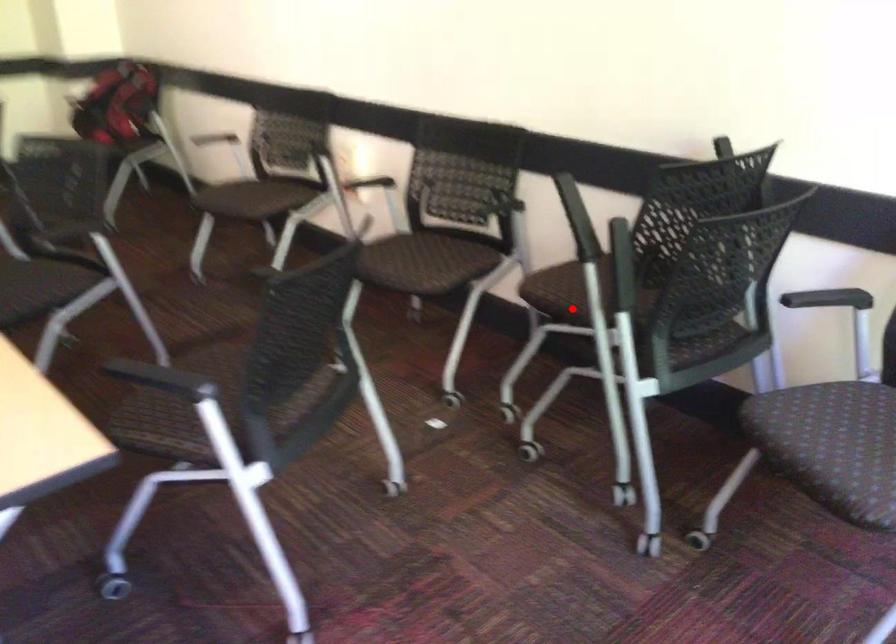
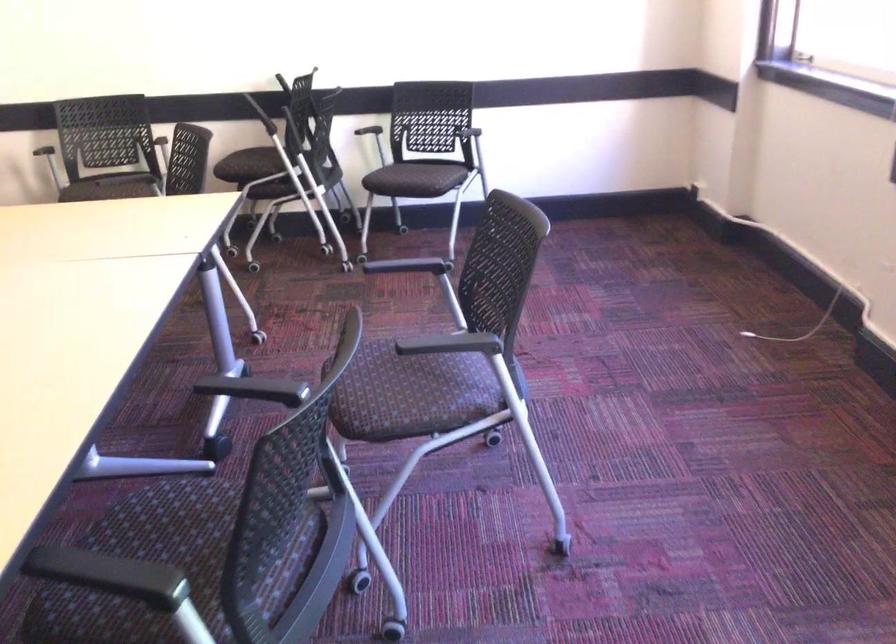
Where in the second image is the point corresponding to the highlighted location from the first image?

(252, 166)